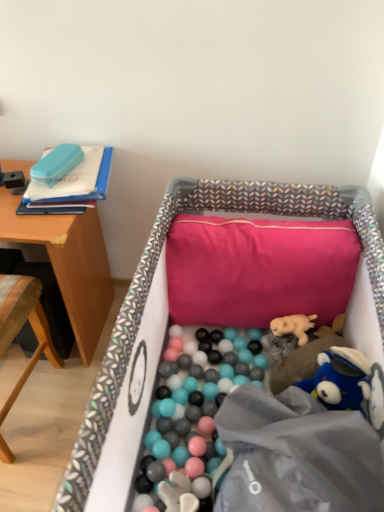
Find the location of `fabric-lined crib at center`. fabric-lined crib at center is located at coordinates (154, 271).

The height and width of the screenshot is (512, 384). In order to click on fluffy beige stuffed animal at center-right, which is counted as the 1th toy, starting from the bottom in this screenshot , I will do `click(302, 348)`.

In order to click on fabric-lined crib at center in this screenshot , I will do `click(154, 271)`.

There is a fluffy beige stuffed animal at center-right, positioned as the third toy in top-to-bottom order. Where is `the 1st toy above it (from a real-world perspective)`? the 1st toy above it (from a real-world perspective) is located at coordinates (293, 326).

Considering the relative positions of fluffy beige plush at center, which appears as the 2th toy when viewed from the top, and fluffy beige stuffed animal at center-right, which appears as the first toy when viewed from the right, in the image provided, is fluffy beige plush at center, which appears as the 2th toy when viewed from the top, to the left of fluffy beige stuffed animal at center-right, which appears as the first toy when viewed from the right, from the viewer's perspective?

Indeed, fluffy beige plush at center, which appears as the 2th toy when viewed from the top, is positioned on the left side of fluffy beige stuffed animal at center-right, which appears as the first toy when viewed from the right.

Is fluffy beige plush at center, which is counted as the second toy, starting from the right, outside of fluffy beige stuffed animal at center-right, which appears as the first toy when viewed from the right?

No, fluffy beige plush at center, which is counted as the second toy, starting from the right, is not entirely external to fluffy beige stuffed animal at center-right, which appears as the first toy when viewed from the right.

Which of these two, fluffy beige plush at center, which is the second toy from left to right, or fluffy beige stuffed animal at center-right, which is counted as the 1th toy, starting from the bottom, stands taller?

fluffy beige stuffed animal at center-right, which is counted as the 1th toy, starting from the bottom.

Which object is wider, wooden desk at left or fabric-lined crib at center?

fabric-lined crib at center.

Is wooden desk at left far from fabric-lined crib at center?

No, there isn't a large distance between wooden desk at left and fabric-lined crib at center.

Is wooden desk at left taller than fabric-lined crib at center?

No.

Which object is closer to the camera taking this photo, wooden desk at left or fabric-lined crib at center?

Positioned in front is fabric-lined crib at center.

Is point (68, 169) farther from camera compared to point (346, 189)?

No.

Locate an element on the screen. The height and width of the screenshot is (512, 384). infant bed in front of the matte blue pencil case at upper left, which appears as the 1th toy when viewed from the top is located at coordinates (154, 271).

Between matte blue pencil case at upper left, the 3th toy from the bottom, and fabric-lined crib at center, which one appears on the left side from the viewer's perspective?

matte blue pencil case at upper left, the 3th toy from the bottom.

Is matte blue pencil case at upper left, which is counted as the first toy, starting from the left, shorter than fabric-lined crib at center?

Correct, matte blue pencil case at upper left, which is counted as the first toy, starting from the left, is not as tall as fabric-lined crib at center.

Considering the sizes of fluffy beige plush at center, which appears as the 2th toy when viewed from the top, and fabric-lined crib at center in the image, is fluffy beige plush at center, which appears as the 2th toy when viewed from the top, taller or shorter than fabric-lined crib at center?

Considering their sizes, fluffy beige plush at center, which appears as the 2th toy when viewed from the top, has less height than fabric-lined crib at center.

From a real-world perspective, is fluffy beige plush at center, which is the second toy from left to right, positioned under fabric-lined crib at center based on gravity?

Yes, from a real-world perspective, fluffy beige plush at center, which is the second toy from left to right, is below fabric-lined crib at center.

Is fluffy beige plush at center, which appears as the 2th toy when viewed from the top, located outside fabric-lined crib at center?

No, fluffy beige plush at center, which appears as the 2th toy when viewed from the top, is inside fabric-lined crib at center's boundary.

From a real-world perspective, which object stands above the other?

wooden chair at left is physically above.

The width and height of the screenshot is (384, 512). In order to click on toy below the wooden chair at left (from the image's perspective) in this screenshot , I will do `click(302, 348)`.

Is wooden chair at left not inside fluffy beige stuffed animal at center-right, positioned as the third toy in top-to-bottom order?

wooden chair at left is positioned outside fluffy beige stuffed animal at center-right, positioned as the third toy in top-to-bottom order.

Which is farther from the camera, (46, 167) or (279, 368)?

The point (46, 167) is behind.

Looking at this image, considering the sizes of matte blue pencil case at upper left, the 3th toy from the bottom, and fluffy beige stuffed animal at center-right, positioned as the third toy in top-to-bottom order, in the image, is matte blue pencil case at upper left, the 3th toy from the bottom, wider or thinner than fluffy beige stuffed animal at center-right, positioned as the third toy in top-to-bottom order,?

matte blue pencil case at upper left, the 3th toy from the bottom, is thinner than fluffy beige stuffed animal at center-right, positioned as the third toy in top-to-bottom order.

Can you confirm if matte blue pencil case at upper left, which is the third toy from right to left, is bigger than fluffy beige stuffed animal at center-right, positioned as the third toy in top-to-bottom order?

Incorrect, matte blue pencil case at upper left, which is the third toy from right to left, is not larger than fluffy beige stuffed animal at center-right, positioned as the third toy in top-to-bottom order.

Looking at this image, can you confirm if fabric-lined crib at center is bigger than matte blue pencil case at upper left, the 3th toy from the bottom?

Yes, fabric-lined crib at center is bigger than matte blue pencil case at upper left, the 3th toy from the bottom.

Between fabric-lined crib at center and matte blue pencil case at upper left, the 3th toy from the bottom, which one has smaller width?

With smaller width is matte blue pencil case at upper left, the 3th toy from the bottom.

From a real-world perspective, is fabric-lined crib at center above or below matte blue pencil case at upper left, the 3th toy from the bottom?

In terms of real-world spatial position, fabric-lined crib at center is below matte blue pencil case at upper left, the 3th toy from the bottom.

Between point (216, 201) and point (74, 152), which one is positioned behind?

The point (74, 152) is farther from the camera.

Where is `the 2nd toy behind the fluffy beige stuffed animal at center-right, positioned as the third toy in top-to-bottom order, counting from the anchor's position`? The width and height of the screenshot is (384, 512). the 2nd toy behind the fluffy beige stuffed animal at center-right, positioned as the third toy in top-to-bottom order, counting from the anchor's position is located at coordinates (293, 326).

Where is `table on the left of fabric-lined crib at center`? table on the left of fabric-lined crib at center is located at coordinates (69, 264).

Looking at this image, based on their spatial positions, is fluffy beige stuffed animal at center-right, acting as the 3th toy starting from the left, or wooden desk at left closer to pink fabric pillow at center?

fluffy beige stuffed animal at center-right, acting as the 3th toy starting from the left, is positioned closer to the anchor pink fabric pillow at center.

Considering their positions, is fluffy beige plush at center, which is counted as the second toy, starting from the right, positioned further to matte blue pencil case at upper left, which is the third toy from right to left, than wooden chair at left?

Among the two, fluffy beige plush at center, which is counted as the second toy, starting from the right, is located further to matte blue pencil case at upper left, which is the third toy from right to left.

Which object lies further to the anchor point fluffy beige plush at center, the second toy ordered from the bottom, fabric-lined crib at center or fluffy beige stuffed animal at center-right, which appears as the first toy when viewed from the right?

Based on the image, fabric-lined crib at center appears to be further to fluffy beige plush at center, the second toy ordered from the bottom.

From the picture: Based on their spatial positions, is fluffy beige plush at center, which appears as the 2th toy when viewed from the top, or wooden chair at left further from wooden desk at left?

fluffy beige plush at center, which appears as the 2th toy when viewed from the top, is positioned further to the anchor wooden desk at left.

Looking at the image, which one is located closer to wooden chair at left, pink fabric pillow at center or fabric-lined crib at center?

fabric-lined crib at center.

Considering their positions, is matte blue pencil case at upper left, which appears as the 1th toy when viewed from the top, positioned further to wooden chair at left than fluffy beige plush at center, the second toy ordered from the bottom?

The object further to wooden chair at left is fluffy beige plush at center, the second toy ordered from the bottom.

From the image, which object appears to be farther from wooden chair at left, fluffy beige stuffed animal at center-right, positioned as the third toy in top-to-bottom order, or fabric-lined crib at center?

The object further to wooden chair at left is fluffy beige stuffed animal at center-right, positioned as the third toy in top-to-bottom order.

When comparing their distances from fabric-lined crib at center, does wooden desk at left or matte blue pencil case at upper left, which is counted as the first toy, starting from the left, seem further?

matte blue pencil case at upper left, which is counted as the first toy, starting from the left.

The height and width of the screenshot is (512, 384). Find the location of `table between wooden chair at left and matte blue pencil case at upper left, which appears as the 1th toy when viewed from the top, in the front-back direction`. table between wooden chair at left and matte blue pencil case at upper left, which appears as the 1th toy when viewed from the top, in the front-back direction is located at coordinates (69, 264).

The height and width of the screenshot is (512, 384). Find the location of `toy between wooden desk at left and fluffy beige plush at center, which appears as the 2th toy when viewed from the top, from left to right`. toy between wooden desk at left and fluffy beige plush at center, which appears as the 2th toy when viewed from the top, from left to right is located at coordinates (56, 164).

This screenshot has width=384, height=512. I want to click on infant bed between wooden desk at left and pink fabric pillow at center, so click(154, 271).

Where is `infant bed situated between wooden chair at left and fluffy beige stuffed animal at center-right, which is counted as the 1th toy, starting from the bottom, from left to right`? Image resolution: width=384 pixels, height=512 pixels. infant bed situated between wooden chair at left and fluffy beige stuffed animal at center-right, which is counted as the 1th toy, starting from the bottom, from left to right is located at coordinates (154, 271).